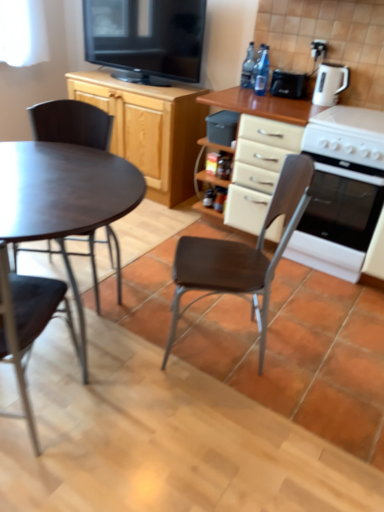
Locate an element on the screen. free space that is in between brown leather chair at center, the third chair viewed from the left, and matte dark brown table at left is located at coordinates (163, 367).